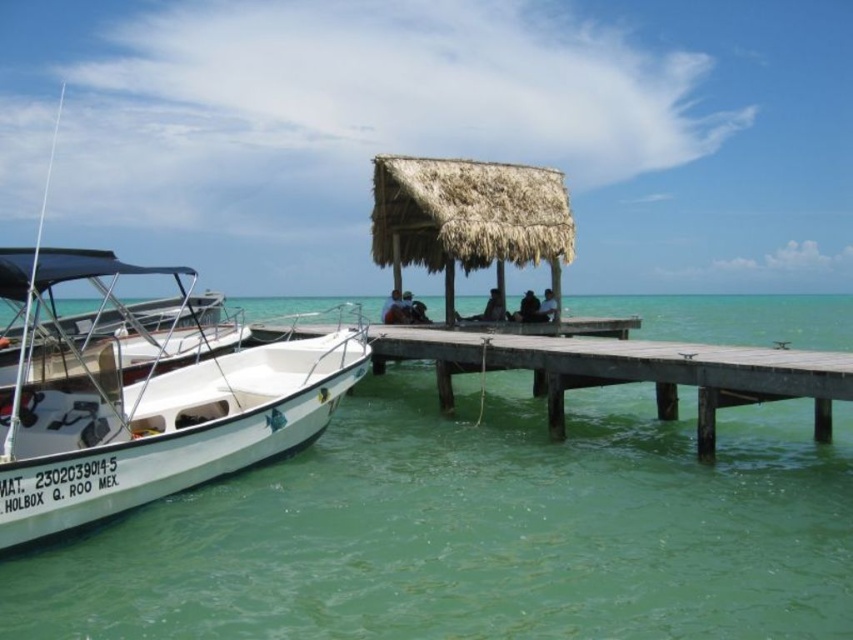
You are a photographer wanting to capture both the thatched straw hut at center and the dark brown hair at center in a single frame. Given their sizes, which object should you focus on to ensure both are clearly visible in your photo?

The thatched straw hut at center is bigger than dark brown hair at center, so focusing on the thatched straw hut at center will help ensure both objects are clearly visible in the photo.

You are standing at the edge of the wooden pier in the coastal scene. There is a dark gray fabric shirt at center. Can you see the thatched roof structure at the end of the pier from where you are standing?

Yes, since the dark gray fabric shirt at center is located at point (x=494, y=307), which is near the center of the image, you can see the thatched roof structure at the end of the pier from your position at the edge of the pier.